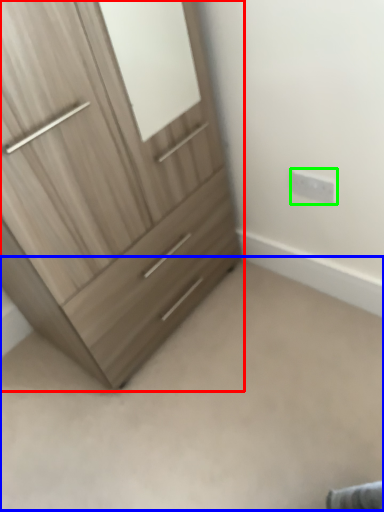
Question: Considering the real-world distances, which object is farthest from chest of drawers (highlighted by a red box)? plain (highlighted by a blue box) or electric outlet (highlighted by a green box)?

Choices:
 (A) plain
 (B) electric outlet

Answer: (B)